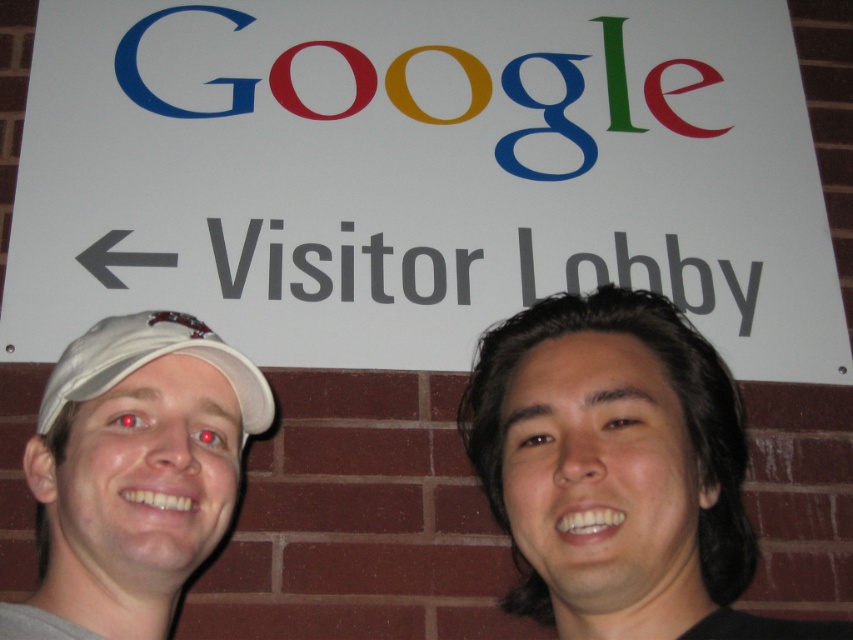
Which is in front, point (625, 230) or point (732, 634)?

Point (732, 634)

Does white paper sign at upper center have a lesser height compared to black hair at right?

No, white paper sign at upper center is not shorter than black hair at right.

Is point (276, 99) more distant than point (688, 515)?

That is True.

Where is `white paper sign at upper center`? This screenshot has height=640, width=853. white paper sign at upper center is located at coordinates (419, 176).

Can you confirm if white matte cap at left is wider than white fabric baseball cap at left?

Incorrect, white matte cap at left's width does not surpass white fabric baseball cap at left's.

Does point (80, 388) come in front of point (132, 337)?

That is True.

This screenshot has height=640, width=853. I want to click on white matte cap at left, so click(137, 467).

Where is `black hair at right`? This screenshot has width=853, height=640. black hair at right is located at coordinates (618, 468).

In the scene shown: Who is positioned more to the right, black hair at right or white fabric baseball cap at left?

Positioned to the right is black hair at right.

The width and height of the screenshot is (853, 640). I want to click on black hair at right, so 618,468.

I want to click on black hair at right, so click(618, 468).